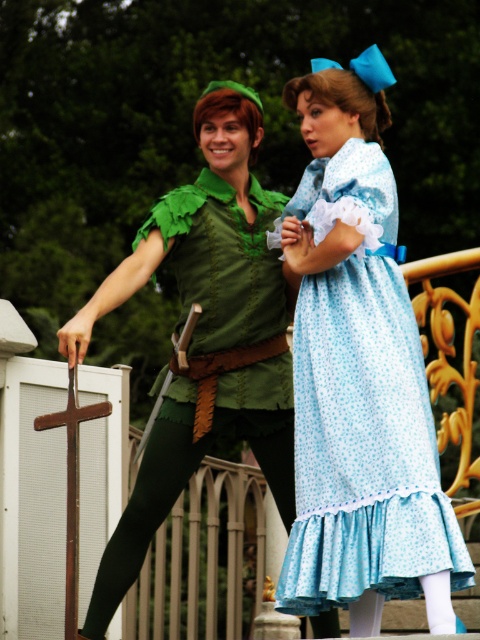
Question: Which point appears farthest from the camera in this image?

Choices:
 (A) (184, 259)
 (B) (288, 448)
 (C) (332, 381)

Answer: (A)

Question: Does light blue floral fabric dress at right appear on the left side of green felt tights at lower left?

Choices:
 (A) yes
 (B) no

Answer: (B)

Question: In this image, where is light blue floral fabric dress at right located relative to light blue floral dress at center?

Choices:
 (A) left
 (B) right

Answer: (B)

Question: Which point is closer to the camera?

Choices:
 (A) green felt tights at lower left
 (B) light blue floral fabric dress at right

Answer: (B)

Question: Which object appears closest to the camera in this image?

Choices:
 (A) light blue floral dress at center
 (B) light blue floral fabric dress at right

Answer: (B)

Question: Can you confirm if light blue floral fabric dress at right is positioned to the left of light blue floral dress at center?

Choices:
 (A) yes
 (B) no

Answer: (B)